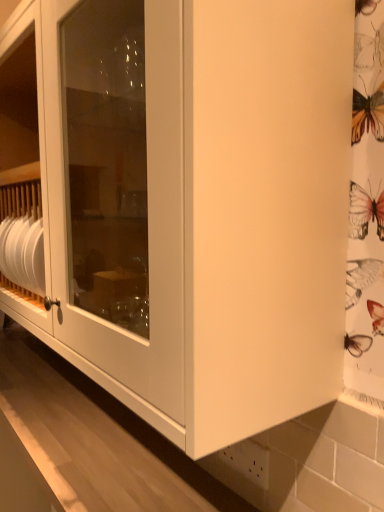
Question: Should I look upward or downward to see white glossy tile at lower right?

Choices:
 (A) down
 (B) up

Answer: (A)